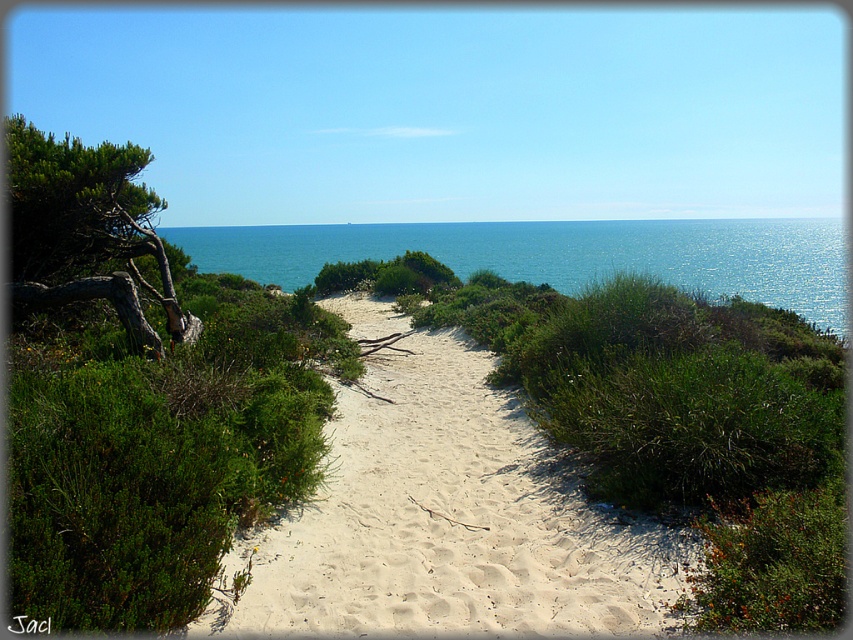
You are standing at the point marked by coordinates point (563, 253). Looking around, what direction would you face to see the blue water at upper center?

The blue water at upper center is represented by point (563, 253), so you are already at the location of the blue water at upper center. Facing any direction would show the surrounding landscape, but the blue water itself is at your current position.

From the picture: You are a hiker carrying a backpack and need to cross the white sandy path at center. The path is 3.30 meters wide. Can you safely walk across it without stepping on the vegetation on either side?

The white sandy path at center is 3.30 meters wide, so yes, you can safely walk across it without stepping on the vegetation on either side since the path is wide enough for a hiker to traverse comfortably.

You are a hiker who has just arrived at the coastal path. You see the blue water at upper center and the green rough bark tree at left. Which object is positioned to the right of the other?

The blue water at upper center is positioned to the right of the green rough bark tree at left.